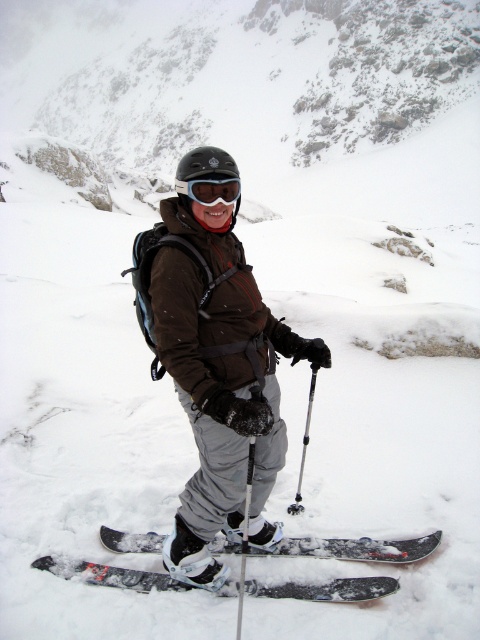
Does brown matte jacket at center have a greater height compared to silver metallic ski pole at center?

Indeed, brown matte jacket at center has a greater height compared to silver metallic ski pole at center.

Who is more forward, (252, 433) or (302, 442)?

Point (252, 433) is more forward.

Image resolution: width=480 pixels, height=640 pixels. In order to click on brown matte jacket at center in this screenshot , I will do `click(215, 372)`.

The height and width of the screenshot is (640, 480). I want to click on brown matte jacket at center, so click(215, 372).

Between transparent plastic goggles at center and silver metallic ski pole at center, which one appears on the left side from the viewer's perspective?

Positioned to the left is transparent plastic goggles at center.

Does transparent plastic goggles at center have a smaller size compared to silver metallic ski pole at center?

Indeed, transparent plastic goggles at center has a smaller size compared to silver metallic ski pole at center.

Between point (180, 192) and point (308, 440), which one is positioned behind?

Point (308, 440)

You are a GUI agent. You are given a task and a screenshot of the screen. Output one action in this format:
    pyautogui.click(x=<x>, y=<y>)
    Task: Click on the transparent plastic goggles at center
    The image size is (480, 640).
    Given the screenshot: What is the action you would take?
    pyautogui.click(x=210, y=189)

Between metallic silver ski pole at center and silver metallic ski pole at center, which one has less height?

silver metallic ski pole at center is shorter.

Measure the distance between point (240,532) and camera.

13.06 feet

Where is `metallic silver ski pole at center`? metallic silver ski pole at center is located at coordinates (244, 532).